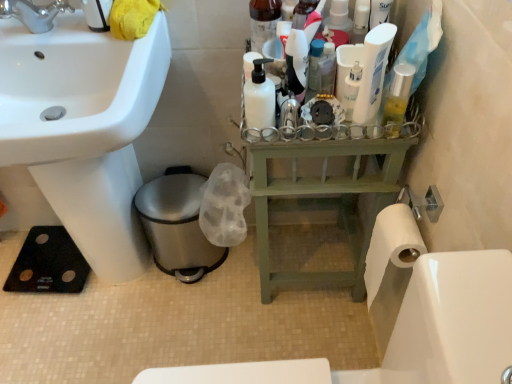
Identify the location of free point below white glossy sink at lower left (from a real-world perspective). (112, 297).